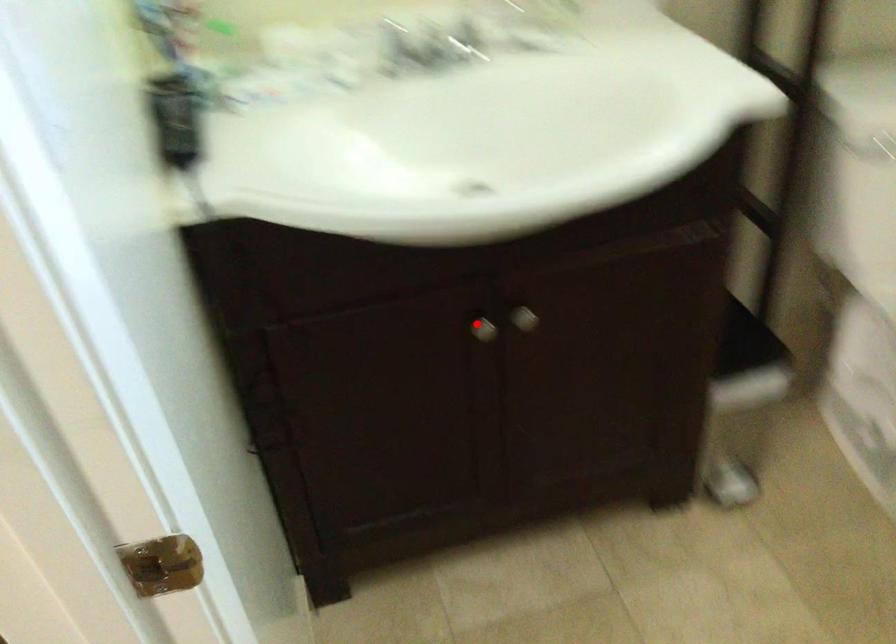
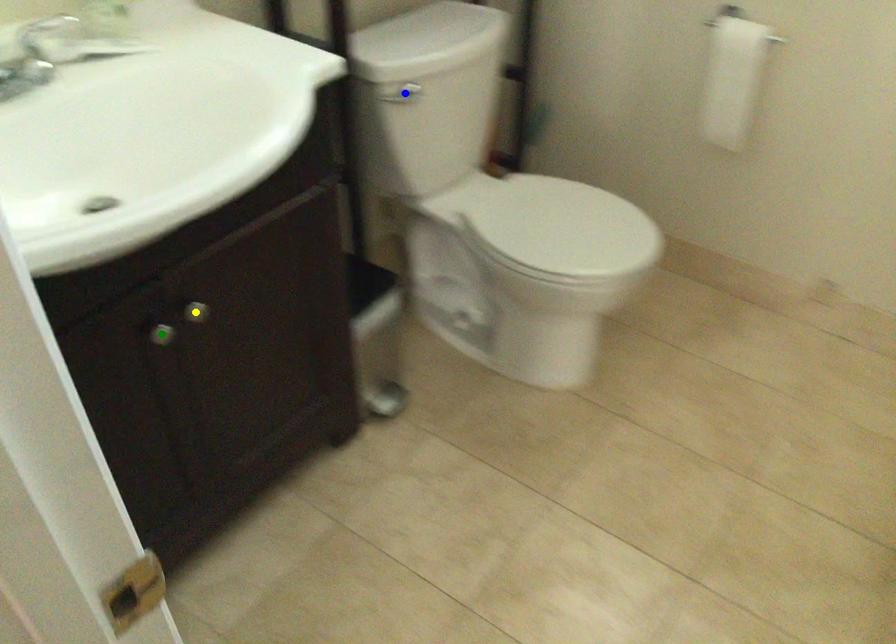
Question: I am providing you with two images of the same scene from different viewpoints. A red point is marked on the first image. You are given multiple points on the second image. Can you choose the point in image 2 that corresponds to the point in image 1?

Choices:
 (A) blue point
 (B) yellow point
 (C) green point

Answer: (C)